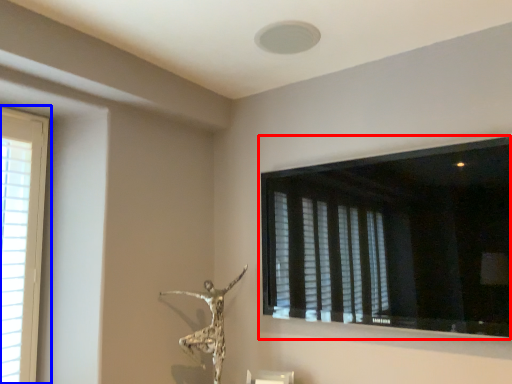
Question: Among these objects, which one is farthest to the camera, window (highlighted by a red box) or window (highlighted by a blue box)?

Choices:
 (A) window
 (B) window

Answer: (B)